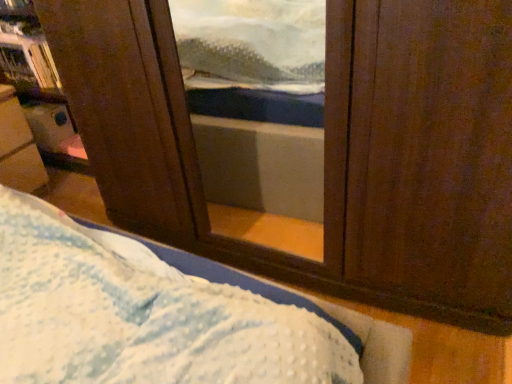
What do you see at coordinates (26, 49) in the screenshot? I see `wooden bookshelf at upper left` at bounding box center [26, 49].

The width and height of the screenshot is (512, 384). I want to click on wooden bookshelf at upper left, so click(x=26, y=49).

At what (x,y) coordinates should I click in order to perform the action: click on metallic silver tray at left. Please return your answer as a coordinate pair (x, y). Looking at the image, I should click on (18, 147).

What do you see at coordinates (18, 147) in the screenshot? I see `metallic silver tray at left` at bounding box center [18, 147].

Locate an element on the screen. The image size is (512, 384). wooden bookshelf at upper left is located at coordinates (26, 49).

Does wooden bookshelf at upper left appear on the right side of metallic silver tray at left?

Yes, wooden bookshelf at upper left is to the right of metallic silver tray at left.

In the image, is wooden bookshelf at upper left positioned in front of or behind metallic silver tray at left?

wooden bookshelf at upper left is behind metallic silver tray at left.

Which is behind, point (4, 10) or point (2, 108)?

Point (4, 10)

From the image's perspective, between wooden bookshelf at upper left and metallic silver tray at left, which one is located above?

wooden bookshelf at upper left, from the image's perspective.

From a real-world perspective, which object stands above the other?

In real-world perspective, wooden bookshelf at upper left is above.

In terms of width, does wooden bookshelf at upper left look wider or thinner when compared to metallic silver tray at left?

wooden bookshelf at upper left is thinner than metallic silver tray at left.

Can you confirm if wooden bookshelf at upper left is taller than metallic silver tray at left?

No, wooden bookshelf at upper left is not taller than metallic silver tray at left.

Based on their sizes in the image, would you say wooden bookshelf at upper left is bigger or smaller than metallic silver tray at left?

Considering their sizes, wooden bookshelf at upper left takes up less space than metallic silver tray at left.

Is wooden bookshelf at upper left not inside metallic silver tray at left?

That's correct, wooden bookshelf at upper left is outside of metallic silver tray at left.

Is wooden bookshelf at upper left far away from metallic silver tray at left?

No, wooden bookshelf at upper left is in close proximity to metallic silver tray at left.

Is metallic silver tray at left at the back of wooden bookshelf at upper left?

No, metallic silver tray at left is not at the back of wooden bookshelf at upper left.

How different are the orientations of wooden bookshelf at upper left and metallic silver tray at left in degrees?

They differ by 90.2 degrees in their facing directions.

Where is `bookshelf to the right of metallic silver tray at left`? The width and height of the screenshot is (512, 384). bookshelf to the right of metallic silver tray at left is located at coordinates (26, 49).

Between metallic silver tray at left and wooden bookshelf at upper left, which one appears on the left side from the viewer's perspective?

metallic silver tray at left.

Which object is further away from the camera taking this photo, metallic silver tray at left or wooden bookshelf at upper left?

Positioned behind is wooden bookshelf at upper left.

Is point (36, 146) closer to viewer compared to point (33, 18)?

That is False.

Based on the photo, from the image's perspective, is metallic silver tray at left located above wooden bookshelf at upper left?

Answer: No.

From a real-world perspective, is metallic silver tray at left under wooden bookshelf at upper left?

Yes, from a real-world perspective, metallic silver tray at left is below wooden bookshelf at upper left.

Considering the relative sizes of metallic silver tray at left and wooden bookshelf at upper left in the image provided, is metallic silver tray at left thinner than wooden bookshelf at upper left?

In fact, metallic silver tray at left might be wider than wooden bookshelf at upper left.

In the scene shown: Considering the sizes of objects metallic silver tray at left and wooden bookshelf at upper left in the image provided, who is shorter, metallic silver tray at left or wooden bookshelf at upper left?

wooden bookshelf at upper left is shorter.

Which of these two, metallic silver tray at left or wooden bookshelf at upper left, is bigger?

metallic silver tray at left is bigger.

Is metallic silver tray at left inside the boundaries of wooden bookshelf at upper left, or outside?

metallic silver tray at left lies outside wooden bookshelf at upper left.

Is metallic silver tray at left not close to wooden bookshelf at upper left?

Actually, metallic silver tray at left and wooden bookshelf at upper left are a little close together.

Looking at this image, is metallic silver tray at left looking in the opposite direction of wooden bookshelf at upper left?

No, wooden bookshelf at upper left is not at the back of metallic silver tray at left.

Find the location of a particular element. furniture in front of the wooden bookshelf at upper left is located at coordinates (18, 147).

Identify the location of bookshelf above the metallic silver tray at left (from a real-world perspective). This screenshot has height=384, width=512. (26, 49).

Image resolution: width=512 pixels, height=384 pixels. I want to click on bookshelf on the right of metallic silver tray at left, so click(x=26, y=49).